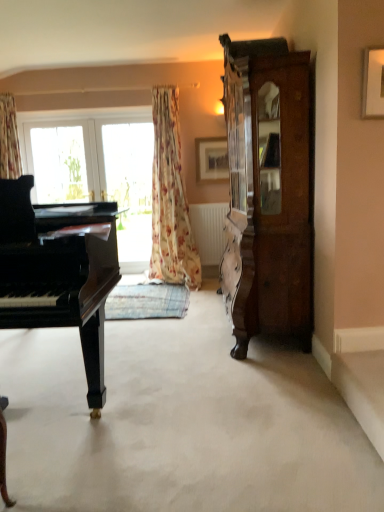
What do you see at coordinates (130, 188) in the screenshot? The image size is (384, 512). I see `clear glass window at center` at bounding box center [130, 188].

Describe the element at coordinates (55, 279) in the screenshot. This screenshot has height=512, width=384. I see `black polished piano at left` at that location.

What is the approximate height of black polished piano at left?

black polished piano at left is 4.01 feet tall.

What do you see at coordinates (209, 231) in the screenshot? I see `white matte radiator at center` at bounding box center [209, 231].

This screenshot has height=512, width=384. Identify the location of dark brown wood cabinet at right. (270, 187).

The image size is (384, 512). I want to click on wooden picture frame at upper right, arranged as the second picture frame when viewed from the back, so click(373, 83).

What do you see at coordinates (97, 173) in the screenshot?
I see `black polished piano at left` at bounding box center [97, 173].

Locate an element on the screen. The width and height of the screenshot is (384, 512). black polished piano at left is located at coordinates (97, 173).

Identify the location of wooden picture frame at upper center, which is the 2th picture frame from front to back. (211, 159).

Can you confirm if white matte radiator at center is shorter than wooden picture frame at upper right, placed as the 1th picture frame when sorted from right to left?

Incorrect, the height of white matte radiator at center does not fall short of that of wooden picture frame at upper right, placed as the 1th picture frame when sorted from right to left.

Does white matte radiator at center appear on the left side of wooden picture frame at upper right, arranged as the second picture frame when viewed from the left?

Yes.

Is white matte radiator at center facing away from wooden picture frame at upper right, placed as the first picture frame when sorted from front to back?

white matte radiator at center does not have its back to wooden picture frame at upper right, placed as the first picture frame when sorted from front to back.

Is wooden picture frame at upper center, placed as the 2th picture frame when sorted from right to left, directly adjacent to floral fabric curtain at center?

wooden picture frame at upper center, placed as the 2th picture frame when sorted from right to left, is not next to floral fabric curtain at center, and they're not touching.

Is point (213, 148) closer or farther from the camera than point (168, 112)?

Point (213, 148) is farther from the camera than point (168, 112).

Could you tell me if wooden picture frame at upper center, which is the first picture frame in back-to-front order, is facing floral fabric curtain at center?

No, wooden picture frame at upper center, which is the first picture frame in back-to-front order, is not facing towards floral fabric curtain at center.

Does wooden picture frame at upper center, placed as the 2th picture frame when sorted from right to left, have a greater height compared to floral fabric curtain at center?

No.

In the image, is black polished piano at left on the left side or the right side of clear glass window at center?

In the image, black polished piano at left appears on the left side of clear glass window at center.

Who is bigger, black polished piano at left or clear glass window at center?

With larger size is black polished piano at left.

Is black polished piano at left wider than clear glass window at center?

Yes, black polished piano at left is wider than clear glass window at center.

Measure the distance between black polished piano at left and clear glass window at center.

A distance of 3.44 meters exists between black polished piano at left and clear glass window at center.

Considering the positions of objects clear glass window at center and wooden picture frame at upper right, arranged as the second picture frame when viewed from the back, in the image provided, who is in front, clear glass window at center or wooden picture frame at upper right, arranged as the second picture frame when viewed from the back,?

wooden picture frame at upper right, arranged as the second picture frame when viewed from the back, is in front.

Considering the positions of objects clear glass window at center and wooden picture frame at upper right, placed as the 1th picture frame when sorted from right to left, in the image provided, who is more to the left, clear glass window at center or wooden picture frame at upper right, placed as the 1th picture frame when sorted from right to left,?

Positioned to the left is clear glass window at center.

Is clear glass window at center oriented towards wooden picture frame at upper right, placed as the 1th picture frame when sorted from right to left?

No, clear glass window at center is not oriented towards wooden picture frame at upper right, placed as the 1th picture frame when sorted from right to left.

Is point (176, 114) closer to viewer compared to point (1, 179)?

No, it is not.

Is floral fabric curtain at center closer to the viewer compared to black polished piano at left?

No.

Could you tell me if floral fabric curtain at center is turned towards black polished piano at left?

No, floral fabric curtain at center is not turned towards black polished piano at left.

Is floral fabric curtain at center facing towards dark brown wood cabinet at right?

No, floral fabric curtain at center is not oriented towards dark brown wood cabinet at right.

From the image's perspective, between floral fabric curtain at center and dark brown wood cabinet at right, who is located below?

dark brown wood cabinet at right, from the image's perspective.

Is floral fabric curtain at center at the left side of dark brown wood cabinet at right?

Yes.

Can you confirm if floral fabric curtain at center is wider than dark brown wood cabinet at right?

Correct, the width of floral fabric curtain at center exceeds that of dark brown wood cabinet at right.

Considering the positions of point (95, 409) and point (164, 141), is point (95, 409) closer or farther from the camera than point (164, 141)?

Point (95, 409).

Locate an element on the screen. Image resolution: width=384 pixels, height=512 pixels. piano located on the left of floral fabric curtain at center is located at coordinates (55, 279).

Based on the photo, between black polished piano at left and floral fabric curtain at center, which one has smaller size?

With smaller size is floral fabric curtain at center.

Where is `picture frame that is the 2nd one when counting forward from the white matte radiator at center`? Image resolution: width=384 pixels, height=512 pixels. picture frame that is the 2nd one when counting forward from the white matte radiator at center is located at coordinates (373, 83).

The image size is (384, 512). Find the location of `picture frame behind the floral fabric curtain at center`. picture frame behind the floral fabric curtain at center is located at coordinates (211, 159).

Looking at the image, which one is located closer to white matte radiator at center, wooden picture frame at upper right, placed as the first picture frame when sorted from front to back, or clear glass window at center?

clear glass window at center.

From the picture: Considering their positions, is wooden picture frame at upper center, which is the 1th picture frame in left-to-right order, positioned further to dark brown wood cabinet at right than black polished piano at left?

The object further to dark brown wood cabinet at right is wooden picture frame at upper center, which is the 1th picture frame in left-to-right order.

Which object lies further to the anchor point black polished piano at left, wooden picture frame at upper center, which is the 1th picture frame in left-to-right order, or wooden picture frame at upper right, placed as the first picture frame when sorted from front to back?

Based on the image, wooden picture frame at upper right, placed as the first picture frame when sorted from front to back, appears to be further to black polished piano at left.

Considering their positions, is clear glass window at center positioned further to wooden picture frame at upper center, which is the first picture frame in back-to-front order, than black polished piano at left?

black polished piano at left is positioned further to the anchor wooden picture frame at upper center, which is the first picture frame in back-to-front order.

Looking at the image, which one is located closer to dark brown wood cabinet at right, wooden picture frame at upper right, placed as the 1th picture frame when sorted from right to left, or black polished piano at left?

The object closer to dark brown wood cabinet at right is wooden picture frame at upper right, placed as the 1th picture frame when sorted from right to left.

When comparing their distances from wooden picture frame at upper center, which is the 1th picture frame in left-to-right order, does floral fabric curtain at center or clear glass window at center seem further?

The object further to wooden picture frame at upper center, which is the 1th picture frame in left-to-right order, is clear glass window at center.

Based on their spatial positions, is white matte radiator at center or dark brown wood cabinet at right further from clear glass window at center?

dark brown wood cabinet at right is further to clear glass window at center.

Looking at the image, which one is located closer to dark brown wood cabinet at right, white matte radiator at center or wooden picture frame at upper center, which is the 1th picture frame in left-to-right order?

The object closer to dark brown wood cabinet at right is white matte radiator at center.

Image resolution: width=384 pixels, height=512 pixels. What are the coordinates of `cabinetry located between black polished piano at left and wooden picture frame at upper right, placed as the first picture frame when sorted from front to back, in the left-right direction` in the screenshot? It's located at (270, 187).

What are the coordinates of `radiator located between clear glass window at center and wooden picture frame at upper center, which is the 1th picture frame in left-to-right order, in the left-right direction` in the screenshot? It's located at (209, 231).

Locate an element on the screen. window frame between dark brown wood cabinet at right and black polished piano at left in the front-back direction is located at coordinates (130, 188).

Where is `radiator between black polished piano at left and clear glass window at center along the z-axis`? radiator between black polished piano at left and clear glass window at center along the z-axis is located at coordinates (209, 231).